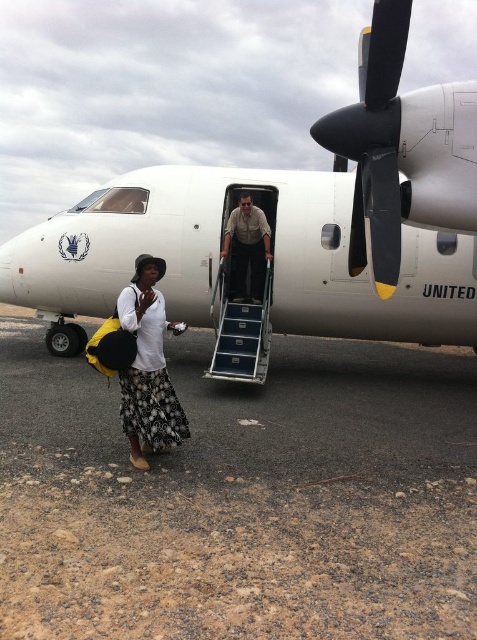
You are a pilot standing on the aircraft and want to step onto the dirt ground at lower left. What coordinates should you aim for?

You should aim for the coordinates point (241, 499) where the dirt ground at lower left is located.

You are a pilot who needs to board the plane. The white matte airplane at center and the white cotton shirt at lower left are in your line of sight. Which object is wider?

The white matte airplane at center is wider than the white cotton shirt at lower left.

You are a passenger who just landed and need to find the nearest exit. You see the dirt ground at lower left and the white matte airplane at center. Which object is larger in the image?

The white matte airplane at center is larger in the image because the dirt ground at lower left occupies less space than it.